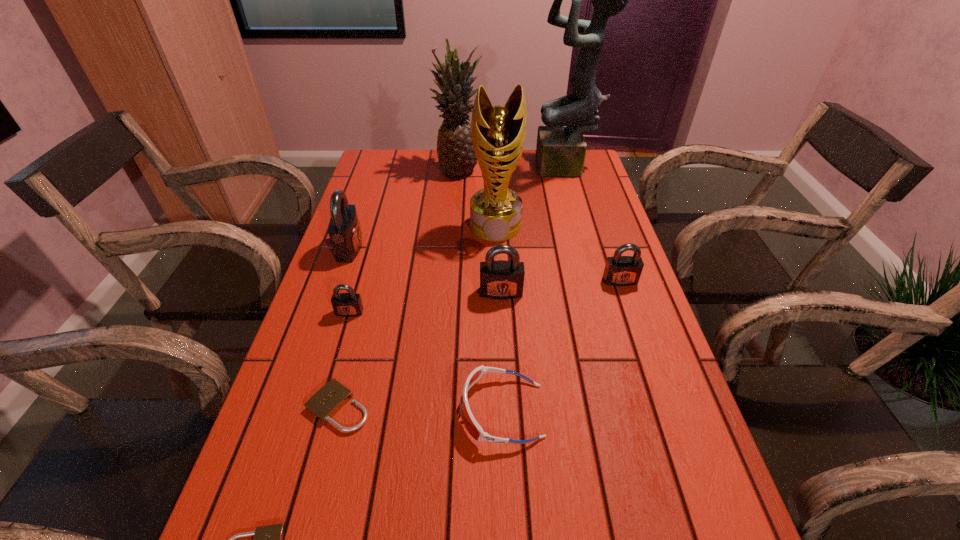
Locate an element on the screen. Image resolution: width=960 pixels, height=540 pixels. the tallest object is located at coordinates (561, 148).

Identify the location of gray sculpture. [x=561, y=148].

You are a GUI agent. You are given a task and a screenshot of the screen. Output one action in this format:
    pyautogui.click(x=<x>, y=<y>)
    Task: Click on the pineapple
    
    Given the screenshot: What is the action you would take?
    pyautogui.click(x=456, y=156)

You are a GUI agent. You are given a task and a screenshot of the screen. Output one action in this format:
    pyautogui.click(x=<x>, y=<y>)
    Task: Click on the award
    This screenshot has height=540, width=960.
    Given the screenshot: What is the action you would take?
    pyautogui.click(x=498, y=132)

Locate an element on the screen. the seventh shortest object is located at coordinates [344, 230].

The width and height of the screenshot is (960, 540). Find the location of `the biggest gray padlock`. the biggest gray padlock is located at coordinates (344, 230).

The width and height of the screenshot is (960, 540). I want to click on the third gray padlock from left to right, so click(x=501, y=279).

Find the location of `the third smallest gray padlock`. the third smallest gray padlock is located at coordinates 501,279.

What are the coordinates of `the fifth shortest object` in the screenshot? It's located at (619, 270).

Identify the location of the fourth shortest padlock. The image size is (960, 540). (619, 270).